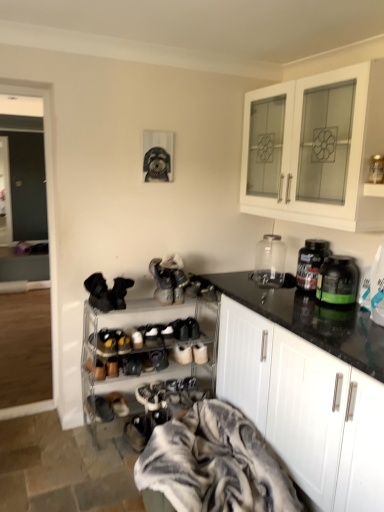
I want to click on free spot below green plastic jar at right, placed as the first bottle when sorted from front to back (from a real-world perspective), so click(323, 304).